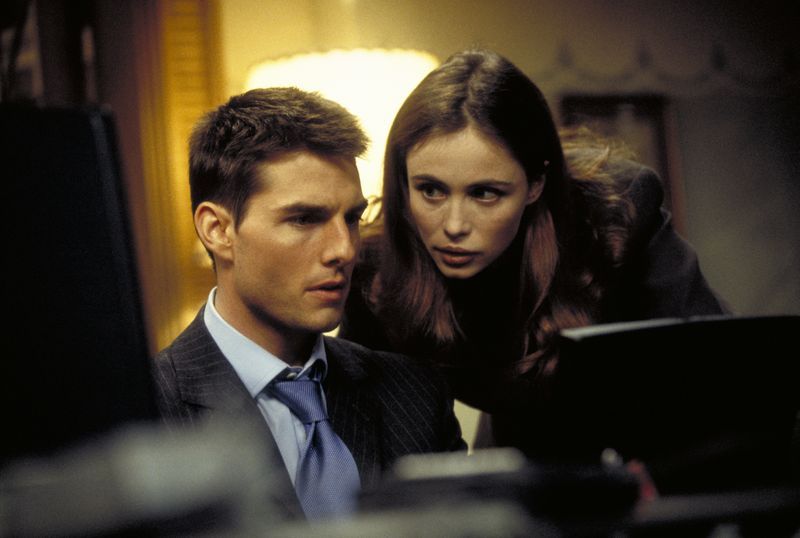
This screenshot has height=538, width=800. Identify the location of lamp. (360, 80).